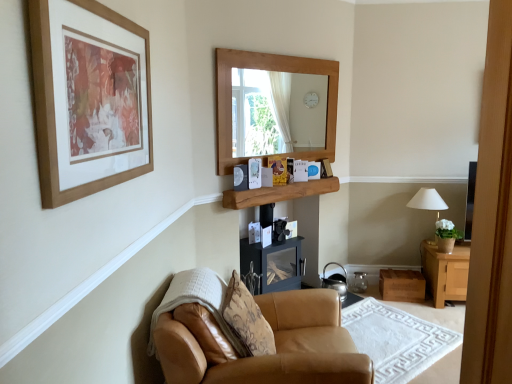
This screenshot has width=512, height=384. What do you see at coordinates (336, 281) in the screenshot? I see `shiny metallic kettle at lower center` at bounding box center [336, 281].

Locate an element on the screen. The width and height of the screenshot is (512, 384). patterned fabric pillow at lower center is located at coordinates (247, 319).

Where is `wooden picture frame at upper left`? The height and width of the screenshot is (384, 512). wooden picture frame at upper left is located at coordinates (88, 99).

Consider the image. From the image's perspective, which is below, patterned fabric pillow at lower center or wooden picture frame at upper left?

patterned fabric pillow at lower center.

Considering the relative sizes of patterned fabric pillow at lower center and wooden picture frame at upper left in the image provided, is patterned fabric pillow at lower center bigger than wooden picture frame at upper left?

Correct, patterned fabric pillow at lower center is larger in size than wooden picture frame at upper left.

Looking at this image, which object is positioned more to the left, patterned fabric pillow at lower center or wooden picture frame at upper left?

wooden picture frame at upper left is more to the left.

Considering the points (224, 303) and (112, 121), which point is behind, point (224, 303) or point (112, 121)?

The point (224, 303) is behind.

Which is nearer, [91,57] or [429,189]?

Clearly, point [91,57] is closer to the camera than point [429,189].

In the scene shown: Is wooden picture frame at upper left bigger than white fabric lampshade at right?

Actually, wooden picture frame at upper left might be smaller than white fabric lampshade at right.

What's the angular difference between wooden picture frame at upper left and white fabric lampshade at right's facing directions?

89.8 degrees.

Based on the photo, is wooden picture frame at upper left in front of or behind white fabric lampshade at right in the image?

Clearly, wooden picture frame at upper left is in front of white fabric lampshade at right.

Which is behind, leather armchair at lower left or tan leather armchair at lower center?

tan leather armchair at lower center is behind.

In the scene shown: Is leather armchair at lower left shorter than tan leather armchair at lower center?

Incorrect, the height of leather armchair at lower left does not fall short of that of tan leather armchair at lower center.

Considering the sizes of objects leather armchair at lower left and tan leather armchair at lower center in the image provided, who is thinner, leather armchair at lower left or tan leather armchair at lower center?

With smaller width is tan leather armchair at lower center.

Is point (207, 297) closer or farther from the camera than point (393, 368)?

Point (207, 297).

In terms of width, does wooden shelf at center look wider or thinner when compared to wooden picture frame at upper left?

Considering their sizes, wooden shelf at center looks broader than wooden picture frame at upper left.

Identify the location of picture frame that appears in front of the wooden shelf at center. (88, 99).

In terms of height, does wooden shelf at center look taller or shorter compared to wooden picture frame at upper left?

wooden shelf at center is shorter than wooden picture frame at upper left.

Is wooden shelf at center looking in the opposite direction of wooden picture frame at upper left?

That's not correct — wooden shelf at center is not looking away from wooden picture frame at upper left.

Could you tell me if white fabric lampshade at right is turned towards patterned fabric pillow at lower center?

No.

Relative to patterned fabric pillow at lower center, is white fabric lampshade at right in front or behind?

In the image, white fabric lampshade at right appears behind patterned fabric pillow at lower center.

Would you consider white fabric lampshade at right to be distant from patterned fabric pillow at lower center?

Yes, white fabric lampshade at right and patterned fabric pillow at lower center are located far from each other.

Based on their sizes in the image, would you say wooden shelf at center is bigger or smaller than green leafy plant in terracotta pot at right?

wooden shelf at center is bigger than green leafy plant in terracotta pot at right.

From a real-world perspective, is wooden shelf at center beneath green leafy plant in terracotta pot at right?

No, from a real-world perspective, wooden shelf at center is not under green leafy plant in terracotta pot at right.

From the image's perspective, between wooden shelf at center and green leafy plant in terracotta pot at right, who is located below?

green leafy plant in terracotta pot at right appears lower in the image.

Based on their positions, is green leafy plant in terracotta pot at right located to the left or right of leather armchair at lower left?

green leafy plant in terracotta pot at right is to the right of leather armchair at lower left.

Is green leafy plant in terracotta pot at right directly adjacent to leather armchair at lower left?

There is a gap between green leafy plant in terracotta pot at right and leather armchair at lower left.

Considering the relative sizes of green leafy plant in terracotta pot at right and leather armchair at lower left in the image provided, is green leafy plant in terracotta pot at right thinner than leather armchair at lower left?

Yes, green leafy plant in terracotta pot at right is thinner than leather armchair at lower left.

Who is bigger, green leafy plant in terracotta pot at right or leather armchair at lower left?

Bigger between the two is leather armchair at lower left.

This screenshot has height=384, width=512. Find the location of `picture frame that is above the patterned fabric pillow at lower center (from a real-world perspective)`. picture frame that is above the patterned fabric pillow at lower center (from a real-world perspective) is located at coordinates (88, 99).

Image resolution: width=512 pixels, height=384 pixels. I want to click on picture frame above the white fabric lampshade at right (from the image's perspective), so click(x=88, y=99).

Which object lies nearer to the anchor point shiny metallic kettle at lower center, tan leather armchair at lower center or leather armchair at lower left?

tan leather armchair at lower center.

When comparing their distances from patterned fabric pillow at lower center, does shiny metallic kettle at lower center or wooden picture frame at upper left seem further?

shiny metallic kettle at lower center lies further to patterned fabric pillow at lower center than the other object.

Estimate the real-world distances between objects in this image. Which object is further from green leafy plant in terracotta pot at right, shiny metallic kettle at lower center or wooden picture frame at upper left?

Based on the image, wooden picture frame at upper left appears to be further to green leafy plant in terracotta pot at right.

Estimate the real-world distances between objects in this image. Which object is closer to wooden shelf at center, patterned fabric pillow at lower center or wooden picture frame at upper left?

Among the two, patterned fabric pillow at lower center is located nearer to wooden shelf at center.

In the scene shown: From the image, which object appears to be nearer to wooden shelf at center, white fabric lampshade at right or wooden picture frame at upper left?

white fabric lampshade at right is closer to wooden shelf at center.

From the image, which object appears to be nearer to wooden picture frame at upper left, patterned fabric pillow at lower center or white fabric lampshade at right?

Based on the image, patterned fabric pillow at lower center appears to be nearer to wooden picture frame at upper left.

When comparing their distances from green leafy plant in terracotta pot at right, does patterned fabric pillow at lower center or wooden shelf at center seem closer?

wooden shelf at center.

Considering their positions, is patterned fabric pillow at lower center positioned closer to green leafy plant in terracotta pot at right than tan leather armchair at lower center?

tan leather armchair at lower center.

Identify the location of houseplant between tan leather armchair at lower center and white fabric lampshade at right along the z-axis. (446, 235).

At what (x,y) coordinates should I click in order to perform the action: click on pillow between wooden picture frame at upper left and leather armchair at lower left in the vertical direction. Please return your answer as a coordinate pair (x, y). The width and height of the screenshot is (512, 384). Looking at the image, I should click on (247, 319).

Locate an element on the screen. The height and width of the screenshot is (384, 512). shelf between wooden picture frame at upper left and white fabric lampshade at right in the front-back direction is located at coordinates (278, 193).

Image resolution: width=512 pixels, height=384 pixels. Identify the location of shelf between patterned fabric pillow at lower center and shiny metallic kettle at lower center in the front-back direction. (278, 193).